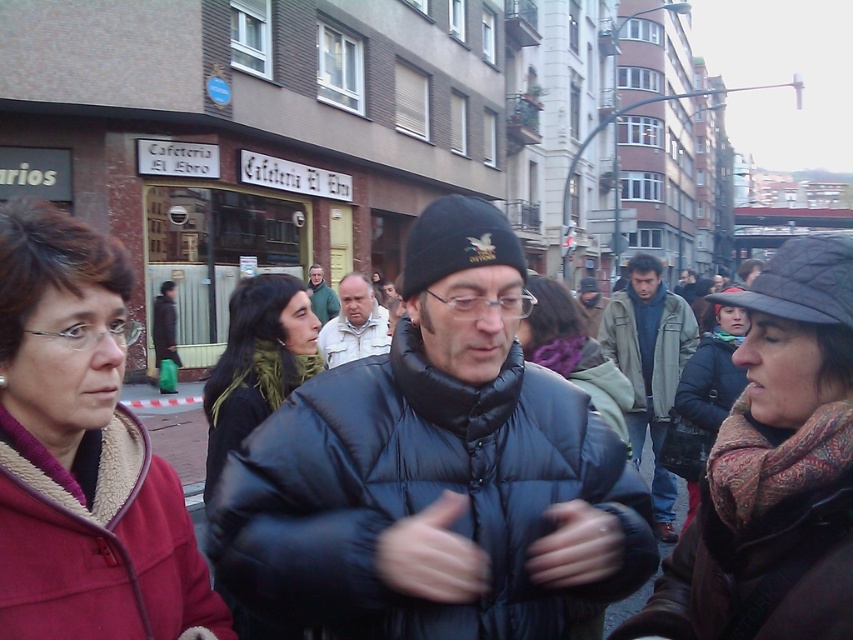
In the scene shown: Does khaki fabric jacket at center lie in front of matte black jacket at center?

No, khaki fabric jacket at center is further to the viewer.

Does point (634, 339) come behind point (595, 280)?

No, (634, 339) is closer to viewer.

The height and width of the screenshot is (640, 853). Identify the location of khaki fabric jacket at center. (671, 352).

Is maroon fleece jacket at center taller than greenish-gray jacket at center?

Incorrect, maroon fleece jacket at center's height is not larger of greenish-gray jacket at center's.

Does point (70, 392) come closer to viewer compared to point (645, 410)?

That is True.

Locate an element on the screen. The width and height of the screenshot is (853, 640). maroon fleece jacket at center is located at coordinates (82, 452).

Describe the element at coordinates (421, 496) in the screenshot. The height and width of the screenshot is (640, 853). I see `black puffy jacket at center` at that location.

Locate an element on the screen. The image size is (853, 640). black puffy jacket at center is located at coordinates [421, 496].

Which is in front, point (247, 509) or point (271, 336)?

Positioned in front is point (247, 509).

I want to click on black puffy jacket at center, so click(421, 496).